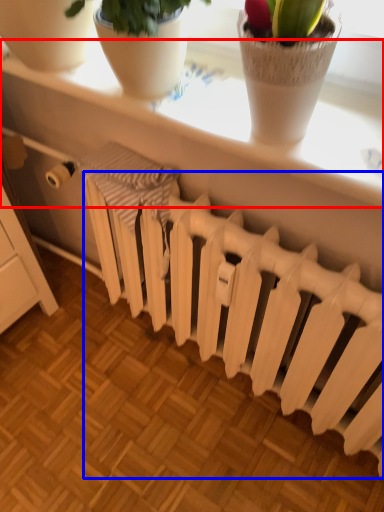
Question: Which of the following is the farthest to the observer, window sill (highlighted by a red box) or radiator (highlighted by a blue box)?

Choices:
 (A) window sill
 (B) radiator

Answer: (B)